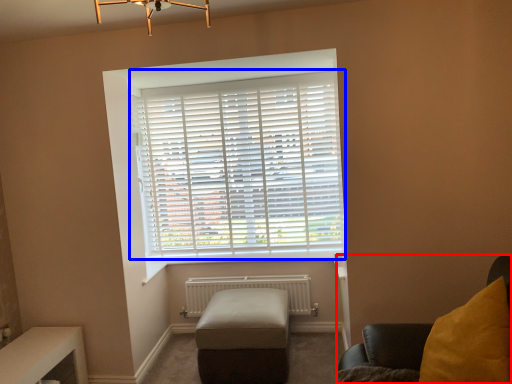
Question: Which point is further to the camera, furniture (highlighted by a red box) or window blind (highlighted by a blue box)?

Choices:
 (A) furniture
 (B) window blind

Answer: (B)